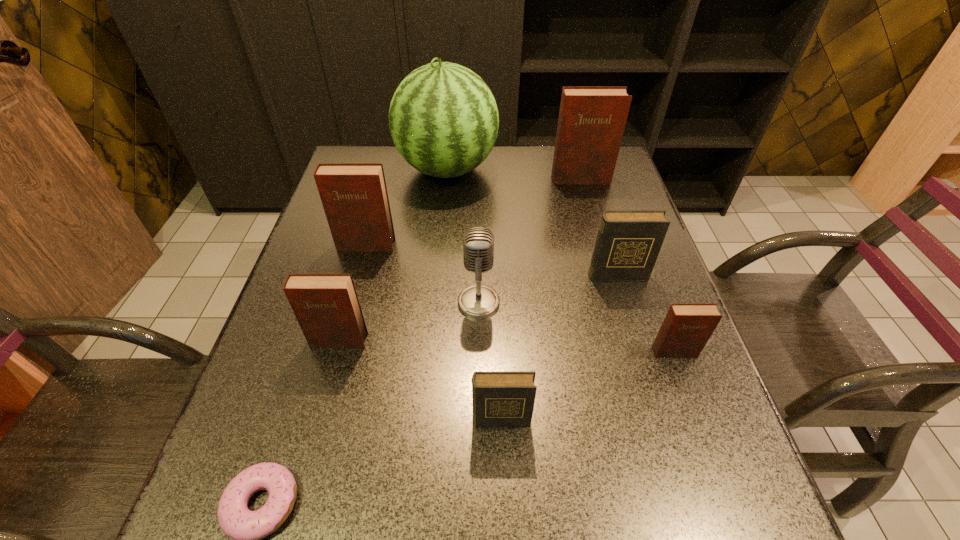
The image size is (960, 540). I want to click on the fourth farthest object, so click(x=628, y=242).

Where is `the nearer dark diary`? the nearer dark diary is located at coordinates (500, 399).

What are the coordinates of `the nearest diary` in the screenshot? It's located at (500, 399).

The image size is (960, 540). I want to click on the smallest reddish-brown diary, so click(x=686, y=329).

Image resolution: width=960 pixels, height=540 pixels. Find the location of `vacant space situated 0.380m on the right of the watermelon`. vacant space situated 0.380m on the right of the watermelon is located at coordinates (620, 170).

At what (x,y) coordinates should I click in order to perform the action: click on vacant space located 0.370m on the front cover of the second tallest object. Please return your answer as a coordinate pair (x, y). This screenshot has height=540, width=960. Looking at the image, I should click on (606, 273).

Identify the location of vacant space located 0.400m on the front cover of the fifth nearest diary. (325, 395).

Identify the location of vacant space located 0.290m on the left of the fifth farthest object. (329, 303).

Find the location of a particular element. The width and height of the screenshot is (960, 540). vacant position located on the front cover of the second smallest reddish-brown diary is located at coordinates (306, 461).

The width and height of the screenshot is (960, 540). I want to click on vacant space located 0.110m on the front cover of the right dark diary, so click(630, 318).